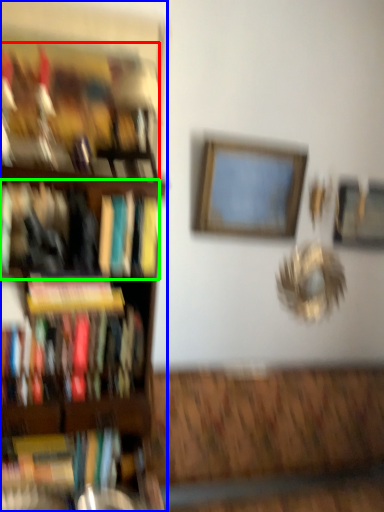
Question: Estimate the real-world distances between objects in this image. Which object is farther from book (highlighted by a red box), shelf (highlighted by a blue box) or book (highlighted by a green box)?

Choices:
 (A) shelf
 (B) book

Answer: (B)